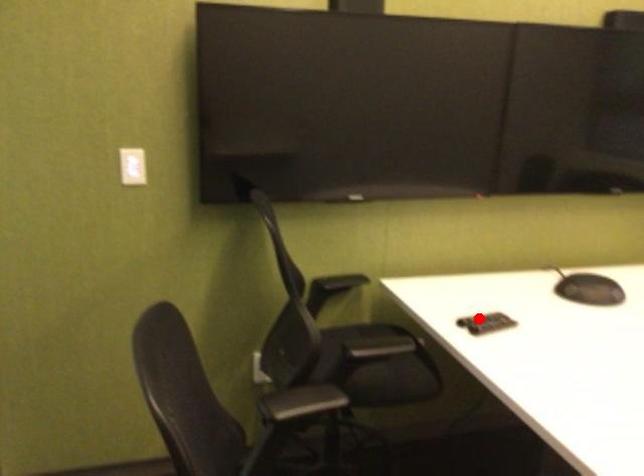
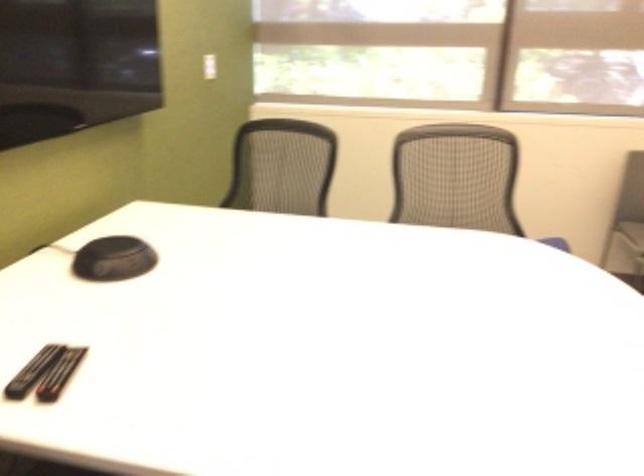
In the second image, find the point that corresponds to the highlighted location in the first image.

(32, 371)